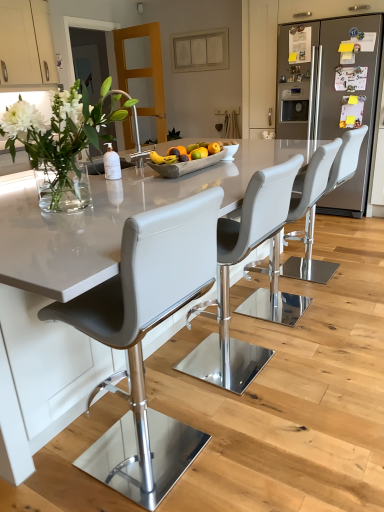
Where is `free spot to the left of white leather bar stool at center, the second chair in the front-to-back sequence`? This screenshot has height=512, width=384. free spot to the left of white leather bar stool at center, the second chair in the front-to-back sequence is located at coordinates [x=162, y=375].